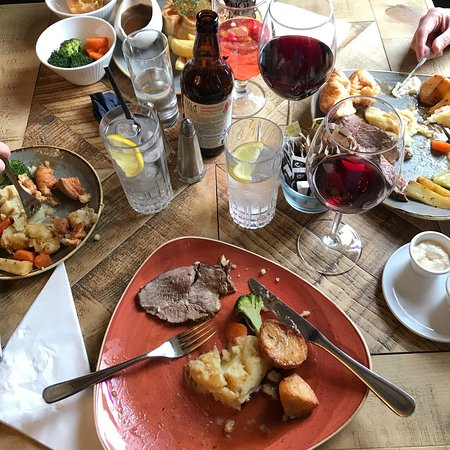
Locate an element on the screen. This screenshot has width=450, height=450. sideplate is located at coordinates (422, 308).